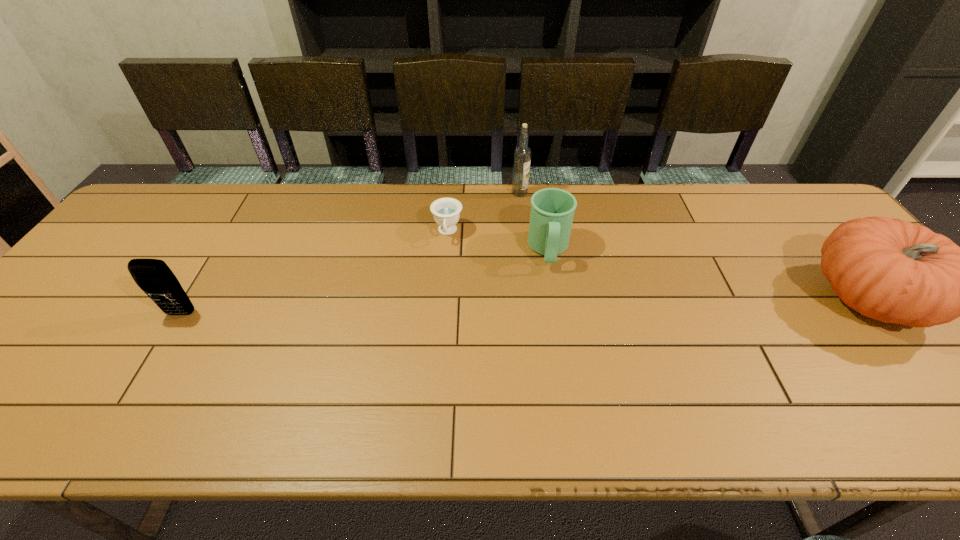
Locate an element on the screen. The width and height of the screenshot is (960, 540). vacant space at the near edge of the desktop is located at coordinates (386, 379).

In the image, there is a desktop. Where is `free space at the far right corner`? This screenshot has width=960, height=540. free space at the far right corner is located at coordinates (756, 186).

I want to click on empty location between the shortest object and the vodka, so click(484, 213).

Find the location of `vacant point located between the farthest object and the leftmost object`. vacant point located between the farthest object and the leftmost object is located at coordinates (350, 253).

At what (x,y) coordinates should I click in order to perform the action: click on free space that is in between the teacup and the vodka. Please return your answer as a coordinate pair (x, y). Image resolution: width=960 pixels, height=540 pixels. Looking at the image, I should click on (484, 213).

The height and width of the screenshot is (540, 960). I want to click on empty space between the leftmost object and the second shortest object, so click(x=365, y=282).

Where is `vacant area that lies between the fourth tallest object and the teacup`? This screenshot has width=960, height=540. vacant area that lies between the fourth tallest object and the teacup is located at coordinates (498, 241).

Locate an element on the screen. free space between the shortest object and the tallest object is located at coordinates (484, 213).

You are a GUI agent. You are given a task and a screenshot of the screen. Output one action in this format:
    pyautogui.click(x=<x>, y=<y>)
    Task: Click on the object that stands as the third closest to the pumpkin
    Image resolution: width=960 pixels, height=540 pixels.
    Given the screenshot: What is the action you would take?
    pyautogui.click(x=446, y=211)

Identify which object is located as the second nearest to the mug. Please provide its 2D coordinates. Your answer should be formatted as a tuple, i.e. [(x, y)], where the tuple contains the x and y coordinates of a point satisfying the conditions above.

[(446, 211)]